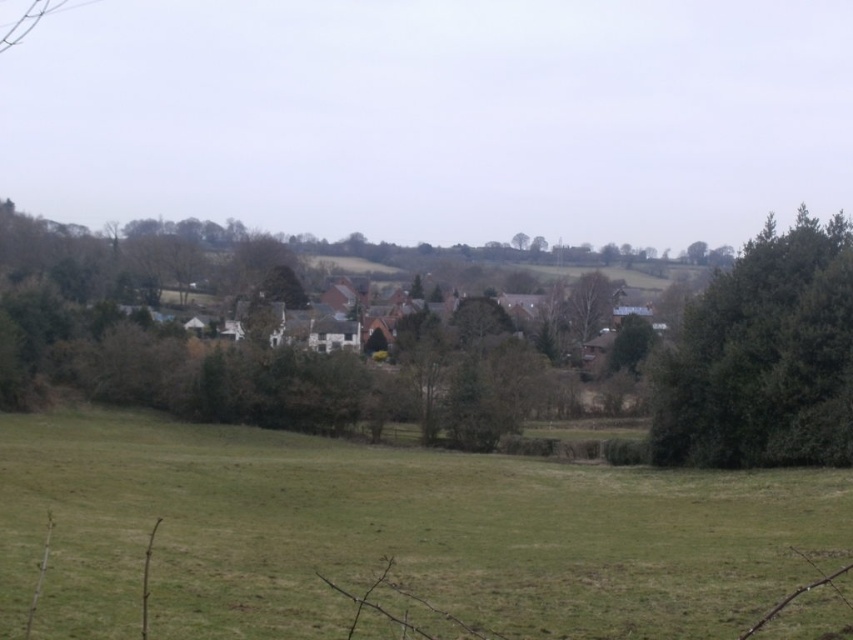
Does green grass at lower center have a larger size compared to green leafy tree at right?

Correct, green grass at lower center is larger in size than green leafy tree at right.

Is green grass at lower center closer to the viewer compared to green leafy tree at right?

That is True.

Find the location of `green grass at lower center`. green grass at lower center is located at coordinates (387, 534).